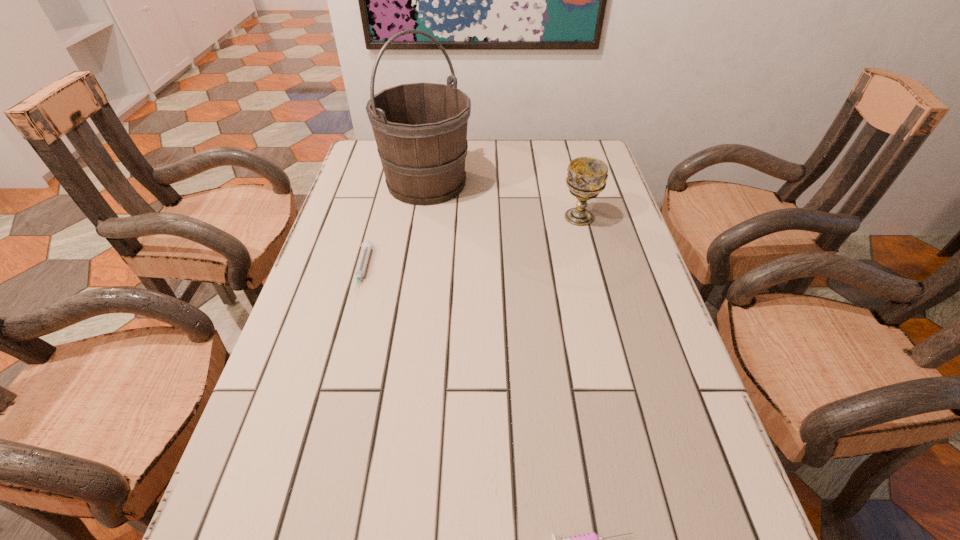
At what (x,y) coordinates should I click in order to perform the action: click on object that is at the right edge. Please return your answer as a coordinate pair (x, y). Image resolution: width=960 pixels, height=540 pixels. Looking at the image, I should click on (586, 178).

At what (x,y) coordinates should I click in order to perform the action: click on object at the far left corner. Please return your answer as a coordinate pair (x, y). Looking at the image, I should click on (x=420, y=129).

Identify the location of free space at the far edge. The image size is (960, 540). (514, 156).

At what (x,y) coordinates should I click in order to perform the action: click on vacant region at the left edge of the desktop. Please return your answer as a coordinate pair (x, y). Looking at the image, I should click on (289, 389).

Identify the location of vacant region at the right edge of the desktop. (664, 327).

Locate an element on the screen. The width and height of the screenshot is (960, 540). vacant region at the far left corner of the desktop is located at coordinates (358, 157).

In the image, there is a desktop. Find the location of `free space at the far right corner`. free space at the far right corner is located at coordinates coord(586,143).

This screenshot has height=540, width=960. In order to click on unoccupied position between the second tallest object and the tallest object in this screenshot , I will do `click(503, 200)`.

You are a GUI agent. You are given a task and a screenshot of the screen. Output one action in this format:
    pyautogui.click(x=<x>, y=<y>)
    Task: Click on the unoccupied area between the third farthest object and the third shortest object
    The image size is (960, 540).
    Given the screenshot: What is the action you would take?
    pyautogui.click(x=470, y=244)

Locate an element on the screen. object that stands as the third closest to the second tallest object is located at coordinates (591, 539).